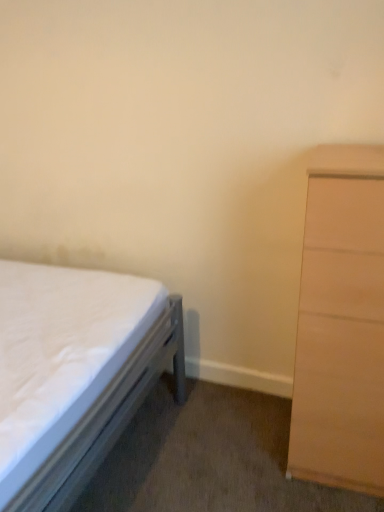
Question: From a real-world perspective, is light brown wood chest of drawers at right positioned above or below white fabric bed at left?

Choices:
 (A) above
 (B) below

Answer: (A)

Question: Is point (357, 444) closer or farther from the camera than point (74, 477)?

Choices:
 (A) closer
 (B) farther

Answer: (B)

Question: Considering the positions of light brown wood chest of drawers at right and white fabric bed at left in the image, is light brown wood chest of drawers at right wider or thinner than white fabric bed at left?

Choices:
 (A) thin
 (B) wide

Answer: (A)

Question: Would you say white fabric bed at left is to the left or to the right of light brown wood chest of drawers at right in the picture?

Choices:
 (A) right
 (B) left

Answer: (B)

Question: Looking at the image, does white fabric bed at left seem bigger or smaller compared to light brown wood chest of drawers at right?

Choices:
 (A) small
 (B) big

Answer: (B)

Question: From the image's perspective, is white fabric bed at left positioned above or below light brown wood chest of drawers at right?

Choices:
 (A) above
 (B) below

Answer: (B)

Question: Considering their positions, is white fabric bed at left located in front of or behind light brown wood chest of drawers at right?

Choices:
 (A) behind
 (B) front

Answer: (B)